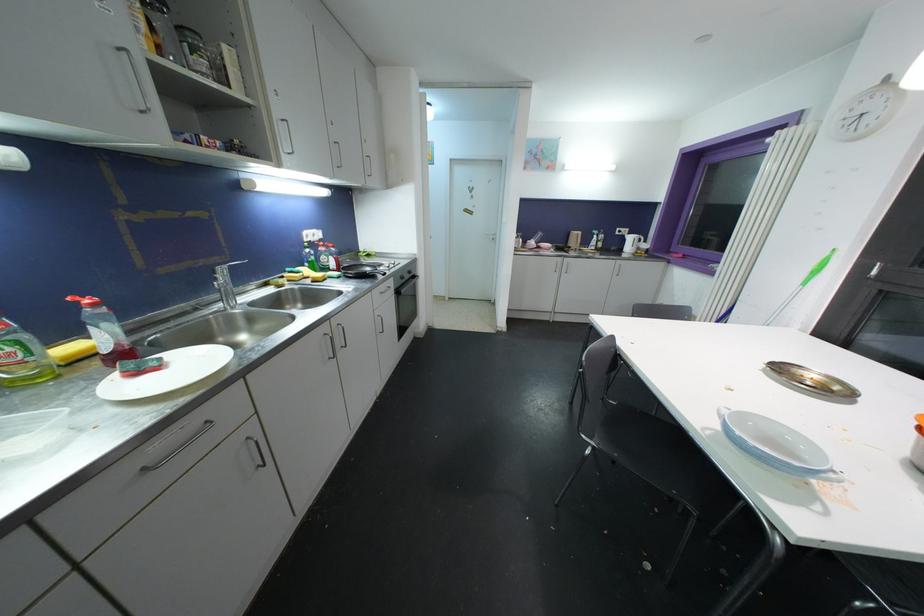
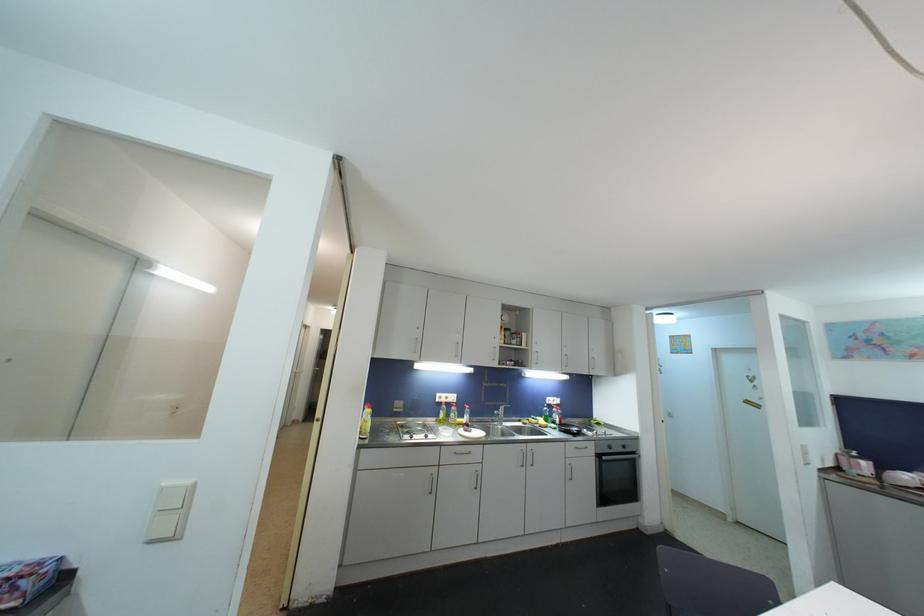
Find the pixel in the second image that matches (x=371, y=272) in the first image.

(578, 432)